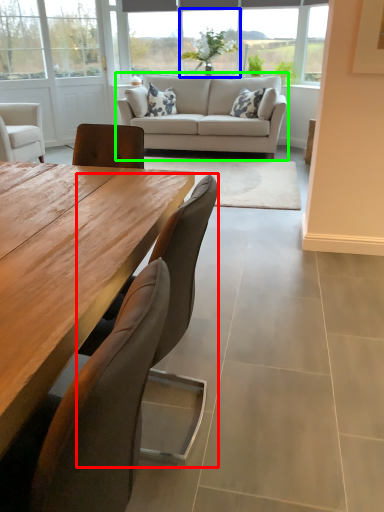
Question: Which object is the closest to the chair (highlighted by a red box)? Choose among these: window (highlighted by a blue box) or studio couch (highlighted by a green box).

Choices:
 (A) window
 (B) studio couch

Answer: (B)